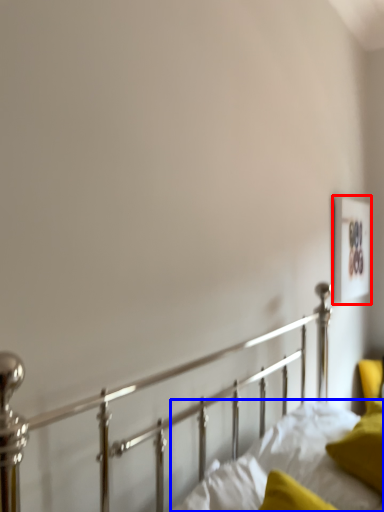
Question: Among these objects, which one is farthest to the camera, picture frame (highlighted by a red box) or mattress (highlighted by a blue box)?

Choices:
 (A) picture frame
 (B) mattress

Answer: (A)